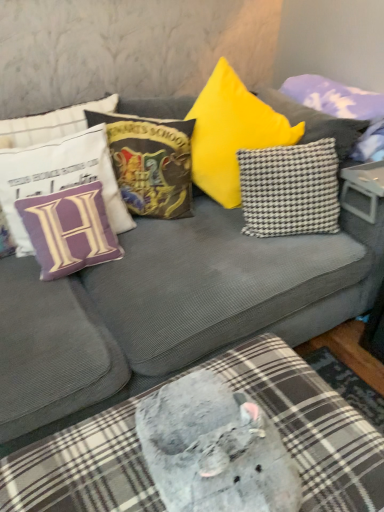
Question: Is black-and-white checkered pillow at center-right, positioned as the 2th pillow in right-to-left order, positioned behind checkered fabric pillow at upper right, acting as the 1th pillow starting from the right?

Choices:
 (A) no
 (B) yes

Answer: (A)

Question: Is black-and-white checkered pillow at center-right, positioned as the 4th pillow in left-to-right order, far from checkered fabric pillow at upper right, which appears as the 5th pillow when viewed from the left?

Choices:
 (A) no
 (B) yes

Answer: (A)

Question: Can you confirm if black-and-white checkered pillow at center-right, positioned as the 4th pillow in left-to-right order, is smaller than checkered fabric pillow at upper right, which appears as the 5th pillow when viewed from the left?

Choices:
 (A) yes
 (B) no

Answer: (A)

Question: Can you confirm if black-and-white checkered pillow at center-right, positioned as the 4th pillow in left-to-right order, is thinner than checkered fabric pillow at upper right, which appears as the 5th pillow when viewed from the left?

Choices:
 (A) no
 (B) yes

Answer: (B)

Question: From a real-world perspective, is black-and-white checkered pillow at center-right, positioned as the 2th pillow in right-to-left order, beneath checkered fabric pillow at upper right, which appears as the 5th pillow when viewed from the left?

Choices:
 (A) yes
 (B) no

Answer: (A)

Question: From a real-world perspective, is black-and-white checkered pillow at center-right, positioned as the 2th pillow in right-to-left order, on checkered fabric pillow at upper right, acting as the 1th pillow starting from the right?

Choices:
 (A) no
 (B) yes

Answer: (A)

Question: Does purple fabric pillow at left, the fourth pillow when ordered from right to left, have a lesser height compared to velvet hogwarts school of witchcraft and wizardry pillow at upper center, which ranks as the third pillow in left-to-right order?

Choices:
 (A) no
 (B) yes

Answer: (B)

Question: Can you confirm if purple fabric pillow at left, the fourth pillow when ordered from right to left, is positioned to the left of velvet hogwarts school of witchcraft and wizardry pillow at upper center, which ranks as the third pillow in left-to-right order?

Choices:
 (A) yes
 (B) no

Answer: (A)

Question: Is there a large distance between purple fabric pillow at left, the fourth pillow when ordered from right to left, and velvet hogwarts school of witchcraft and wizardry pillow at upper center, which is counted as the third pillow, starting from the right?

Choices:
 (A) yes
 (B) no

Answer: (B)

Question: Is purple fabric pillow at left, which ranks as the second pillow in left-to-right order, turned away from velvet hogwarts school of witchcraft and wizardry pillow at upper center, which is counted as the third pillow, starting from the right?

Choices:
 (A) yes
 (B) no

Answer: (B)

Question: Is purple fabric pillow at left, which ranks as the second pillow in left-to-right order, in front of velvet hogwarts school of witchcraft and wizardry pillow at upper center, which is counted as the third pillow, starting from the right?

Choices:
 (A) yes
 (B) no

Answer: (A)

Question: Is purple fabric pillow at left, the fourth pillow when ordered from right to left, touching velvet hogwarts school of witchcraft and wizardry pillow at upper center, which ranks as the third pillow in left-to-right order?

Choices:
 (A) no
 (B) yes

Answer: (A)

Question: Is velvet hogwarts school of witchcraft and wizardry pillow at upper center, which ranks as the third pillow in left-to-right order, bigger than checkered fabric pillow at upper right, which appears as the 5th pillow when viewed from the left?

Choices:
 (A) no
 (B) yes

Answer: (A)